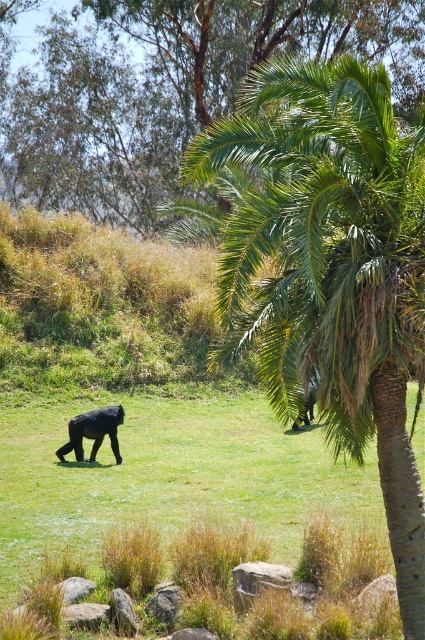
Question: Which point appears closest to the camera in this image?

Choices:
 (A) (95, 449)
 (B) (274, 136)
 (C) (136, 154)

Answer: (B)

Question: Is green leafy palm tree at center closer to the viewer compared to green leafy palm at upper center?

Choices:
 (A) yes
 (B) no

Answer: (A)

Question: Considering the relative positions of green leafy palm at upper center and shiny black gorilla at center in the image provided, where is green leafy palm at upper center located with respect to shiny black gorilla at center?

Choices:
 (A) right
 (B) left

Answer: (A)

Question: Observing the image, what is the correct spatial positioning of green leafy palm tree at center in reference to shiny black gorilla at center?

Choices:
 (A) above
 (B) below

Answer: (A)

Question: Which object is farther from the camera taking this photo?

Choices:
 (A) green leafy palm at upper center
 (B) green leafy palm tree at center
 (C) shiny black gorilla at center

Answer: (A)

Question: Which of the following is the closest to the observer?

Choices:
 (A) green leafy palm at upper center
 (B) shiny black gorilla at center

Answer: (B)